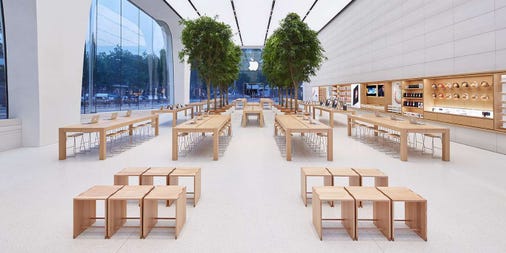
At what (x,y) coordinates should I click in order to perform the action: click on light. Please return your answer as a coordinate pair (x, y). This screenshot has height=253, width=506. Looking at the image, I should click on (255, 10).